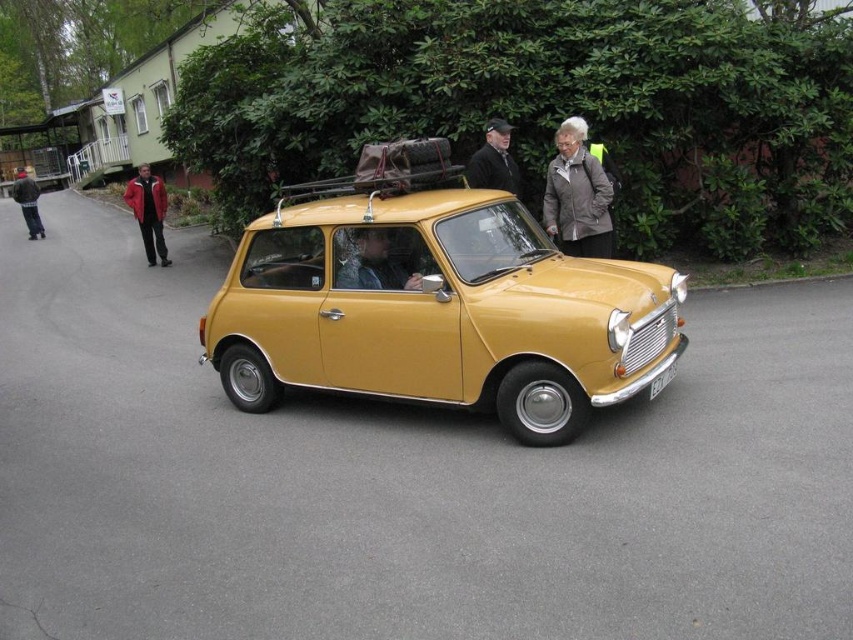
Question: Does yellow matte car at center appear on the right side of brushed metal jacket at left?

Choices:
 (A) no
 (B) yes

Answer: (B)

Question: Considering the real-world distances, which object is closest to the brushed metal jacket at left?

Choices:
 (A) matte gray jacket at center
 (B) yellow matte car at center
 (C) white plastic license plate at center
 (D) matte black jacket at center

Answer: (A)

Question: Which point appears closest to the camera in this image?

Choices:
 (A) (553, 189)
 (B) (618, 378)

Answer: (B)

Question: Where is matte black jacket at center located in relation to brushed metal jacket at left in the image?

Choices:
 (A) left
 (B) right

Answer: (B)

Question: Among these points, which one is nearest to the camera?

Choices:
 (A) (22, 204)
 (B) (154, 216)

Answer: (B)

Question: Is yellow matte car at center smaller than matte black jacket at center?

Choices:
 (A) no
 (B) yes

Answer: (A)